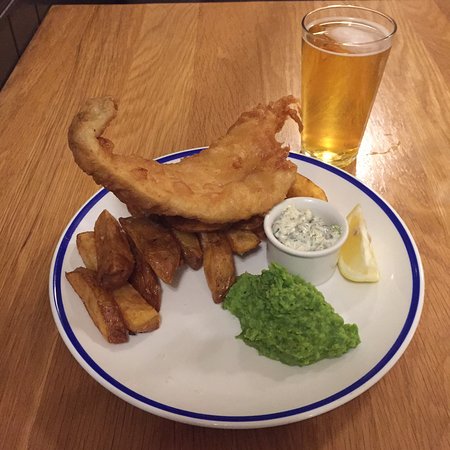
Locate an element on the screen. wood grain table top is located at coordinates (178, 115).